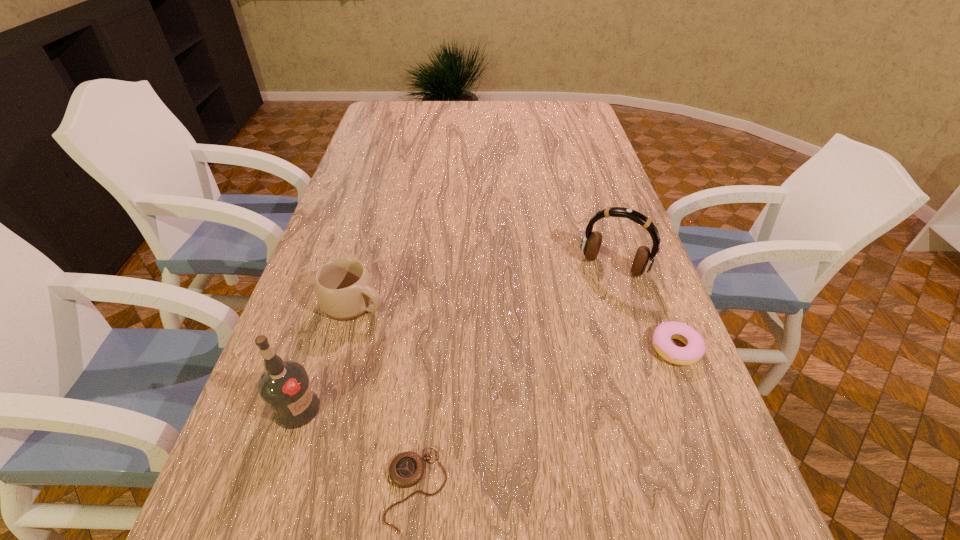
Image resolution: width=960 pixels, height=540 pixels. I want to click on vacant point located between the shortest object and the third farthest object, so click(x=545, y=418).

Image resolution: width=960 pixels, height=540 pixels. I want to click on vacant space that's between the third tallest object and the pocket watch, so click(386, 396).

Find the location of `the third closest object to the fourth nearest object`. the third closest object to the fourth nearest object is located at coordinates point(590,245).

Locate which object is the closest to the farthest object. Please provide its 2D coordinates. Your answer should be formatted as a tuple, i.e. [(x, y)], where the tuple contains the x and y coordinates of a point satisfying the conditions above.

[(694, 349)]